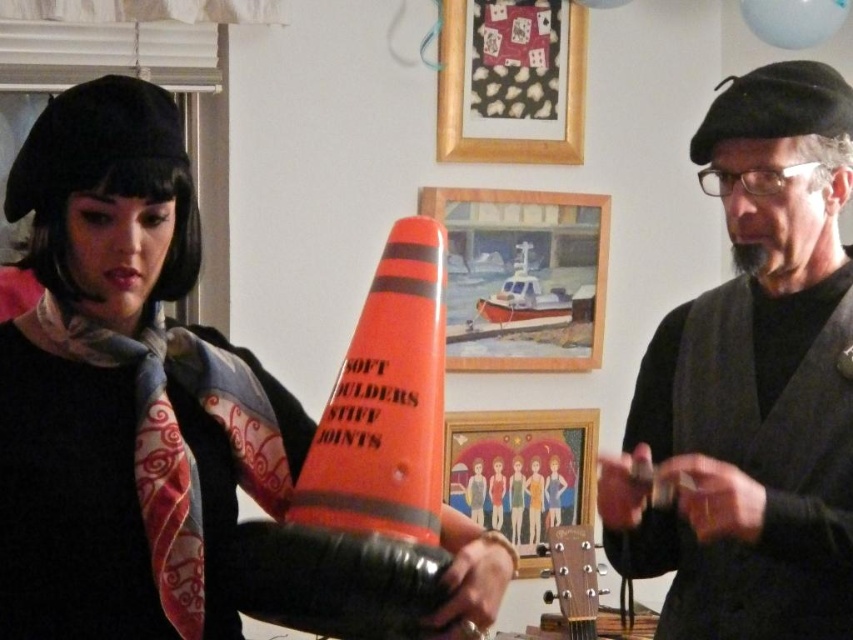
Question: Is matte black cone at center closer to camera compared to matte orange cone at center?

Choices:
 (A) yes
 (B) no

Answer: (A)

Question: Can you confirm if matte black cone at center is wider than orange reflective cone at center?

Choices:
 (A) yes
 (B) no

Answer: (A)

Question: Which point is closer to the camera?

Choices:
 (A) (157, 480)
 (B) (819, 234)

Answer: (A)

Question: Is matte black beret at upper right closer to the viewer compared to orange reflective cone at center?

Choices:
 (A) yes
 (B) no

Answer: (B)

Question: Which object is closer to the camera taking this photo?

Choices:
 (A) matte orange cone at center
 (B) matte black beret at upper right
 (C) orange reflective cone at center

Answer: (C)

Question: Which is nearer to the orange reflective cone at center?

Choices:
 (A) matte orange cone at center
 (B) matte black beret at upper right
 (C) matte black cone at center

Answer: (C)